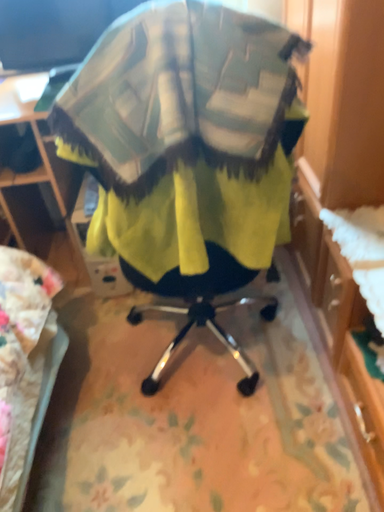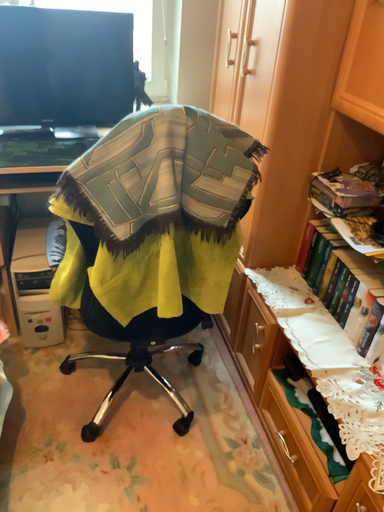
Question: Which way did the camera rotate in the video?

Choices:
 (A) rotated downward
 (B) rotated upward

Answer: (B)